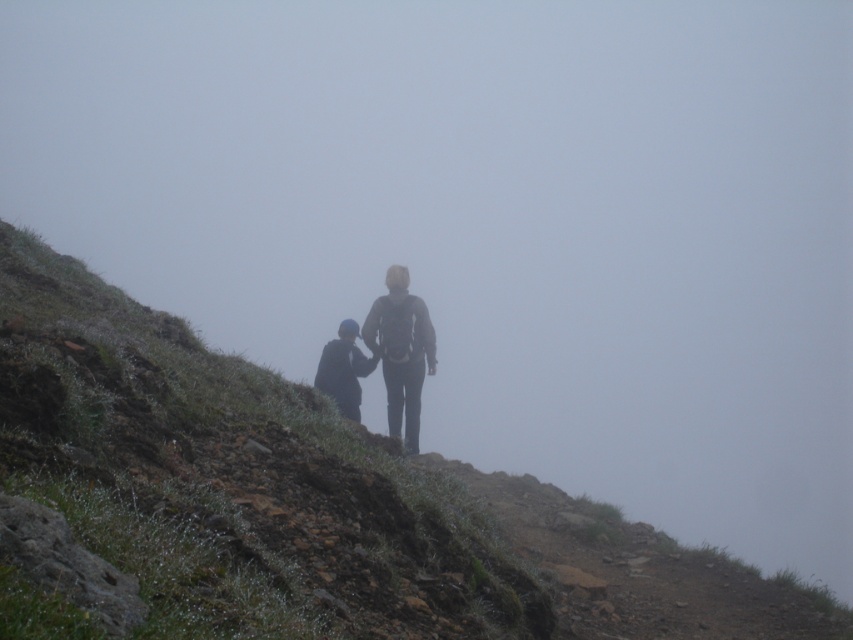
You are a hiker planning to walk along the path shown in the image. You notice two hikers wearing dark gray fabric jacket at center and dark blue fabric jacket at center. Which hiker is taller?

The dark gray fabric jacket at center is taller than the dark blue fabric jacket at center.

You are planning to set up a small tent for shelter in the scene described. The tent requires a flat area larger than the dark blue fabric jacket at center. Can the dull brown dirt at center provide enough space for the tent?

The dull brown dirt at center is larger in size than the dark blue fabric jacket at center, so yes, the dull brown dirt at center can provide enough space for the tent since it is bigger than the required area.

You are a hiker trying to avoid getting your dark gray fabric jacket at center wet. You see the dull brown dirt at center ahead. Based on their positions, which object is higher up the slope and might have drier ground?

The dull brown dirt at center is much taller than dark gray fabric jacket at center, so the dull brown dirt at center is higher up the slope and likely has drier ground.